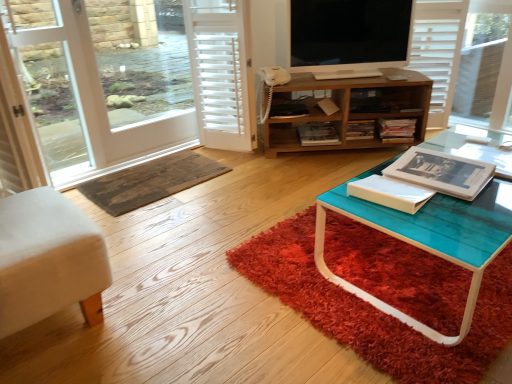
This screenshot has height=384, width=512. Find the location of `free space that is in between white fabric cushion at lower left and wooden cabinet at center`. free space that is in between white fabric cushion at lower left and wooden cabinet at center is located at coordinates (225, 202).